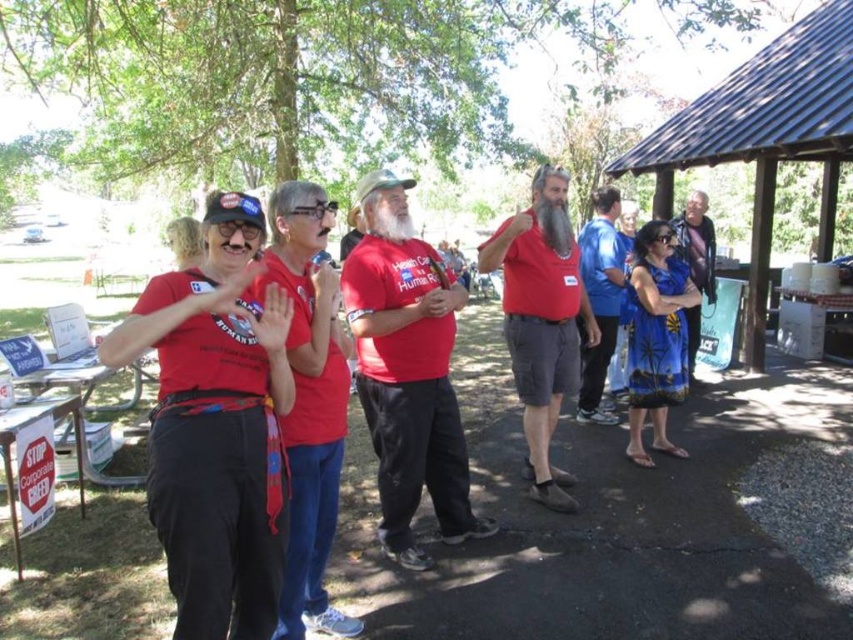
Looking at this image, you are standing at the gazebo with a dark metal roof and looking towards the group of people wearing red Tshirts. There are two points marked in the image. Which point is closer to you, point [444,524] or point [605,371]?

Point [444,524] is in front of point [605,371], so it is closer to you.

You are standing at the origin point of the image. There is a matte red tank top at center located at point (541,320). Can you tell me the coordinates of the matte red tank top at center?

The coordinates of the matte red tank top at center are point (541,320).